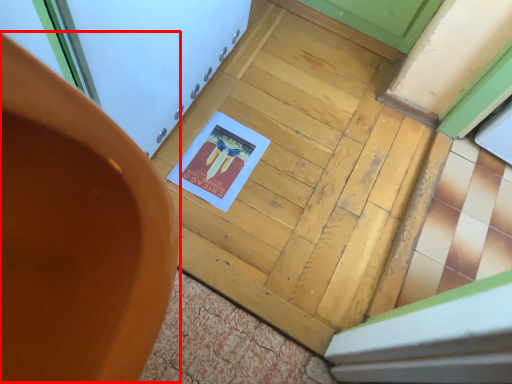
Question: In this image, where is chair (annotated by the red box) located relative to door?

Choices:
 (A) left
 (B) right

Answer: (A)